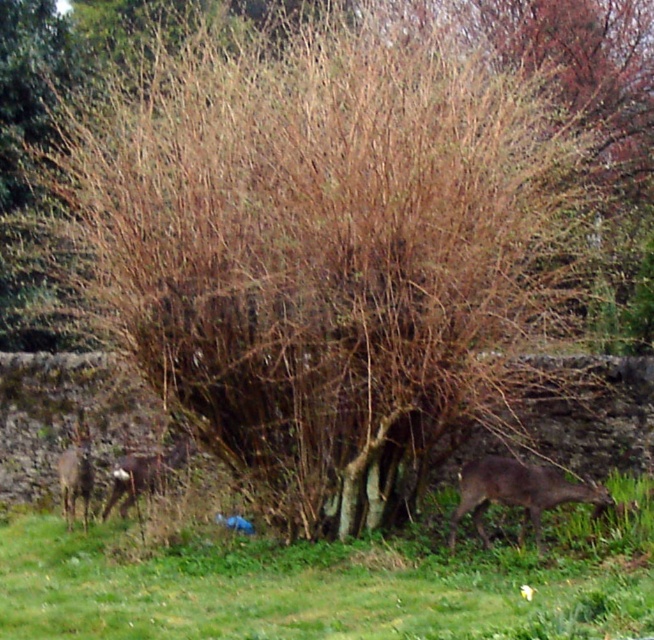
Question: Does brown furry deer at lower right have a smaller size compared to brown furry deer at left?

Choices:
 (A) yes
 (B) no

Answer: (B)

Question: Which object appears farthest from the camera in this image?

Choices:
 (A) brown furry deer at lower right
 (B) green grass at lower center

Answer: (A)

Question: Where is brown furry deer at lower right located in relation to brown furry deer at center in the image?

Choices:
 (A) right
 (B) left

Answer: (A)

Question: Which is farther from the green grass at lower center?

Choices:
 (A) brown furry deer at lower right
 (B) brown furry deer at left

Answer: (B)

Question: Which object appears closest to the camera in this image?

Choices:
 (A) green grass at lower center
 (B) brown furry deer at center
 (C) brown furry deer at lower right
 (D) brown furry deer at left

Answer: (A)

Question: Is brown furry deer at lower right thinner than brown furry deer at left?

Choices:
 (A) yes
 (B) no

Answer: (B)